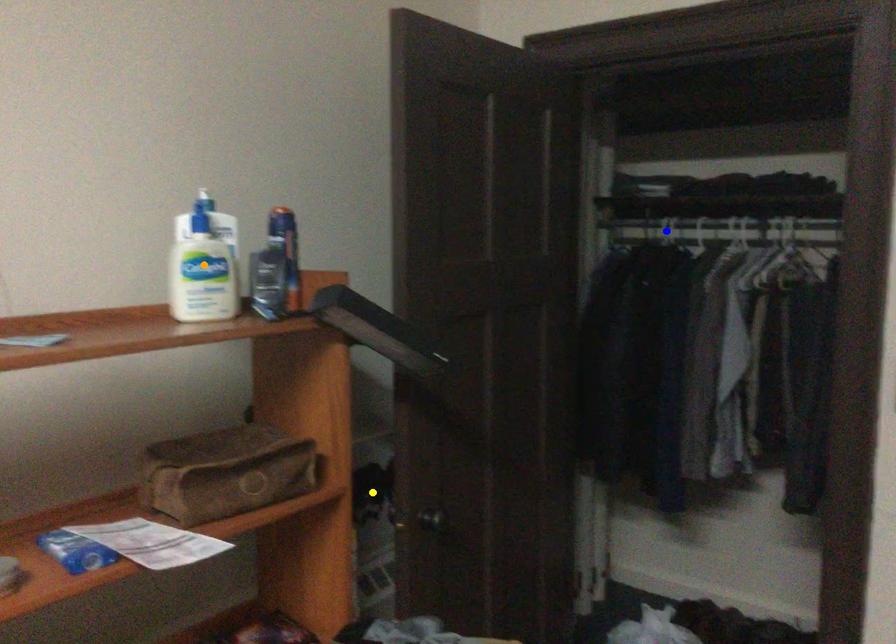
Order these from nearest to farthest:
1. orange point
2. blue point
3. yellow point

orange point → yellow point → blue point